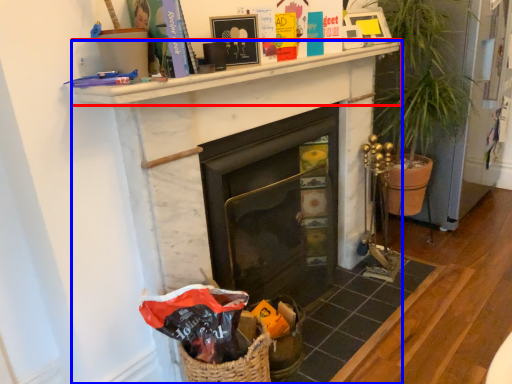
Question: Which object is closer to the camera taking this photo, mantle (highlighted by a red box) or fireplace (highlighted by a blue box)?

Choices:
 (A) mantle
 (B) fireplace

Answer: (A)